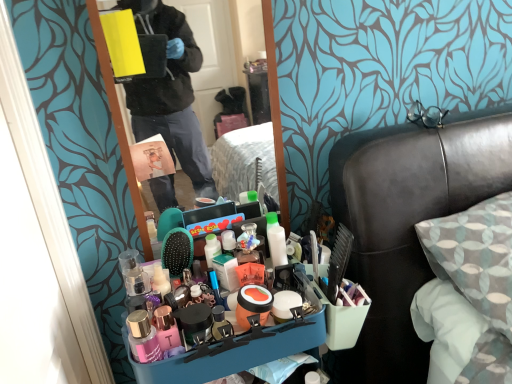
Question: Could you tell me if matte pink book at center is facing black leather headboard at upper right?

Choices:
 (A) yes
 (B) no

Answer: (B)

Question: Does matte pink book at center come in front of black leather headboard at upper right?

Choices:
 (A) yes
 (B) no

Answer: (B)

Question: From a real-world perspective, is matte pink book at center located beneath black leather headboard at upper right?

Choices:
 (A) yes
 (B) no

Answer: (B)

Question: From the image's perspective, is matte pink book at center over black leather headboard at upper right?

Choices:
 (A) no
 (B) yes

Answer: (B)

Question: Considering the relative sizes of matte pink book at center and black leather headboard at upper right in the image provided, is matte pink book at center bigger than black leather headboard at upper right?

Choices:
 (A) yes
 (B) no

Answer: (B)

Question: Is matte pink book at center oriented away from black leather headboard at upper right?

Choices:
 (A) no
 (B) yes

Answer: (A)

Question: Considering the relative positions of black leather headboard at upper right and yellow matte box at upper left in the image provided, is black leather headboard at upper right to the right of yellow matte box at upper left from the viewer's perspective?

Choices:
 (A) yes
 (B) no

Answer: (A)

Question: Is black leather headboard at upper right wider than yellow matte box at upper left?

Choices:
 (A) yes
 (B) no

Answer: (A)

Question: Is yellow matte box at upper left completely or partially inside black leather headboard at upper right?

Choices:
 (A) yes
 (B) no

Answer: (B)

Question: Can you confirm if black leather headboard at upper right is positioned to the left of yellow matte box at upper left?

Choices:
 (A) yes
 (B) no

Answer: (B)

Question: Is black leather headboard at upper right turned away from yellow matte box at upper left?

Choices:
 (A) no
 (B) yes

Answer: (A)

Question: From a real-world perspective, is black leather headboard at upper right below yellow matte box at upper left?

Choices:
 (A) no
 (B) yes

Answer: (B)

Question: Can we say black leather headboard at upper right lies outside clear plastic mirror at center?

Choices:
 (A) yes
 (B) no

Answer: (A)